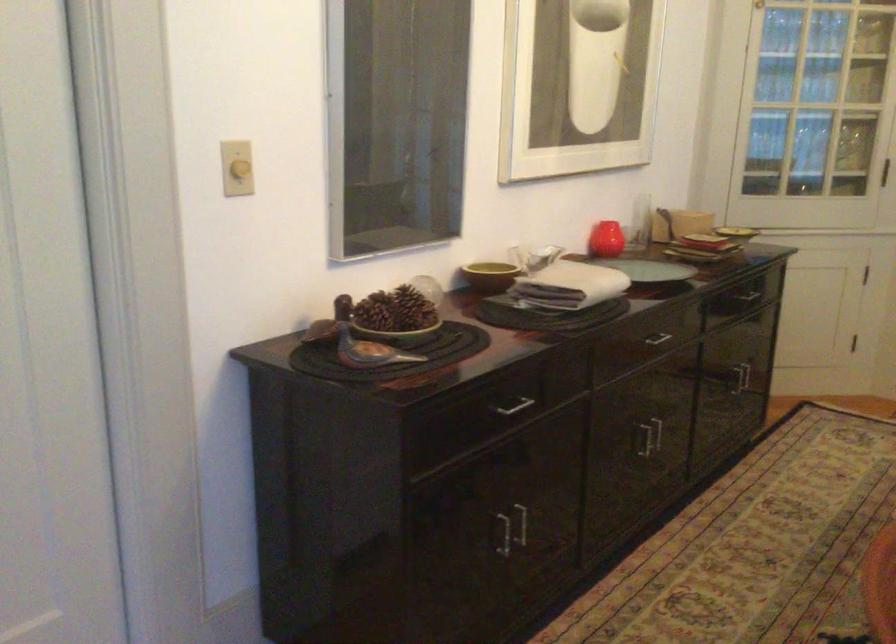
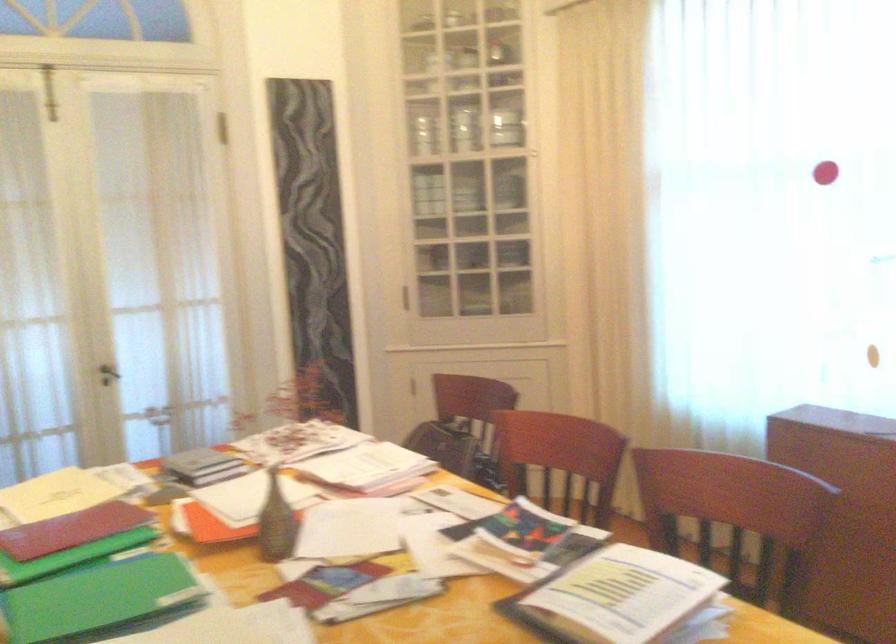
Question: The camera is either moving clockwise (left) or counter-clockwise (right) around the object. The first image is from the beginning of the video and the second image is from the end. Is the camera moving left or right when shooting the video?

Choices:
 (A) Left
 (B) Right

Answer: (A)